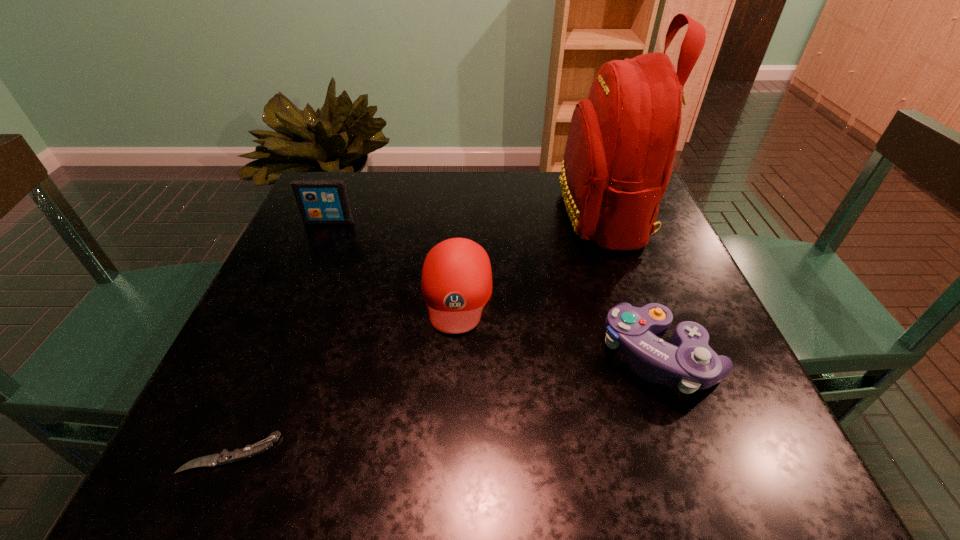
Image resolution: width=960 pixels, height=540 pixels. Find the location of `object situated at the far left corner`. object situated at the far left corner is located at coordinates (320, 201).

This screenshot has width=960, height=540. Identify the location of object situated at the near left corner. (225, 457).

Where is `object that is at the far right corner`? The image size is (960, 540). object that is at the far right corner is located at coordinates (622, 140).

Identify the location of vacant space at the far edge of the desktop. Image resolution: width=960 pixels, height=540 pixels. (447, 192).

The image size is (960, 540). Identify the location of free region at the near edge of the desktop. (321, 419).

This screenshot has height=540, width=960. In the image, there is a desktop. What are the coordinates of `vacant space at the left edge` in the screenshot? It's located at (300, 261).

In the image, there is a desktop. Identify the location of vacant space at the right edge. (670, 269).

Locate an element on the screen. This screenshot has width=960, height=540. unoccupied position between the backpack and the third object from left to right is located at coordinates (530, 253).

At what (x,y) coordinates should I click in order to perform the action: click on unoccupied position between the backpack and the third object from right to left. Please return your answer as a coordinate pair (x, y). The image size is (960, 540). Looking at the image, I should click on (530, 253).

This screenshot has height=540, width=960. What are the coordinates of `vacant space that's between the shortest object and the control` in the screenshot? It's located at (445, 404).